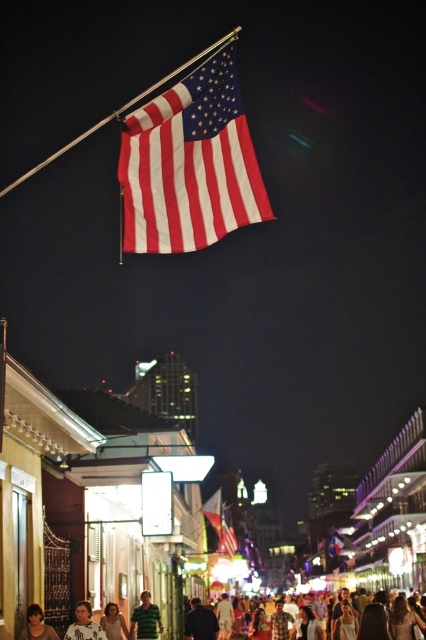
Question: Estimate the real-world distances between objects in this image. Which object is farther from the matte white crowd at center?

Choices:
 (A) smooth brown hair at lower left
 (B) white shirt at center
 (C) white cotton shirt at center
 (D) matte fabric flag at center

Answer: (D)

Question: Can you confirm if green striped shirt at center is wider than smooth brown hair at lower left?

Choices:
 (A) no
 (B) yes

Answer: (B)

Question: Which of these objects is positioned closest to the smooth brown hair at lower left?

Choices:
 (A) white cotton shirt at center
 (B) matte white crowd at center

Answer: (A)

Question: Does matte white crowd at center have a greater width compared to smooth brown hair at lower left?

Choices:
 (A) yes
 (B) no

Answer: (A)

Question: Which object appears closest to the camera in this image?

Choices:
 (A) matte fabric flag at center
 (B) white cotton shirt at center
 (C) green striped shirt at center

Answer: (B)

Question: Can you confirm if black matte jacket at center is positioned to the left of matte fabric flag at center?

Choices:
 (A) yes
 (B) no

Answer: (A)